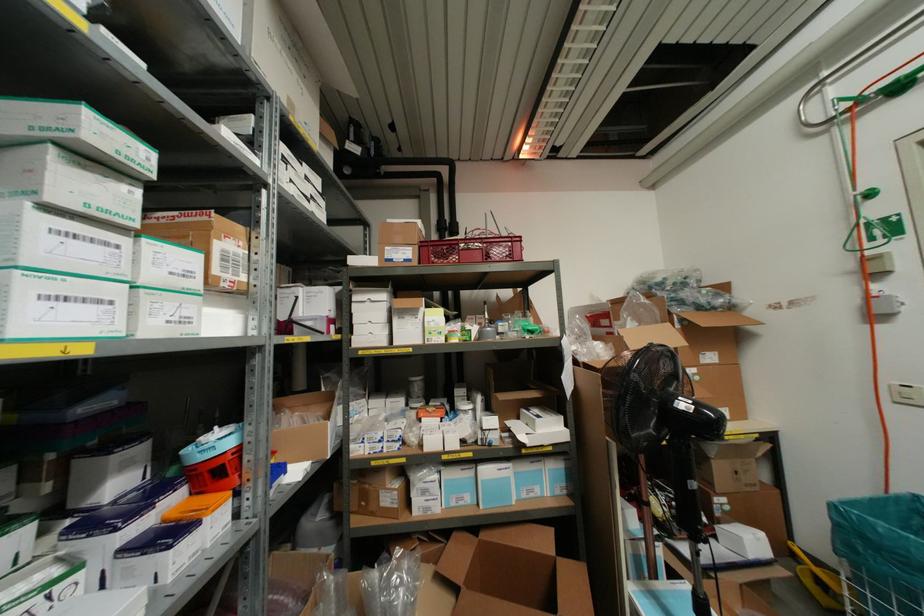
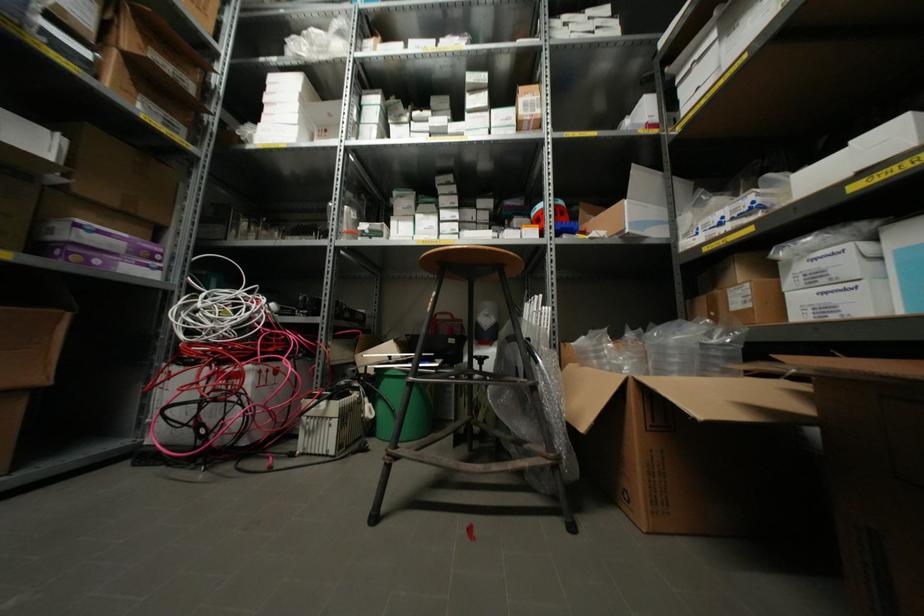
Where in the second image is the point corresponding to [214,270] from the first image?

(519, 111)